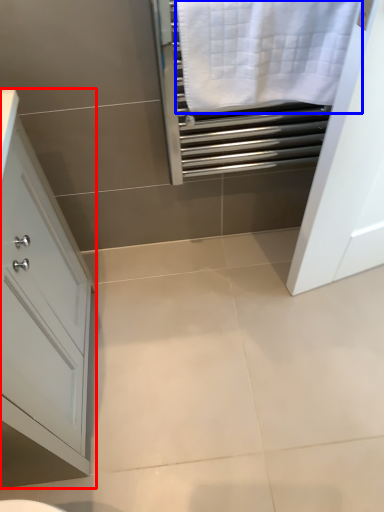
Question: Among these objects, which one is nearest to the camera, bathroom cabinet (highlighted by a red box) or bath towel (highlighted by a blue box)?

Choices:
 (A) bathroom cabinet
 (B) bath towel

Answer: (A)